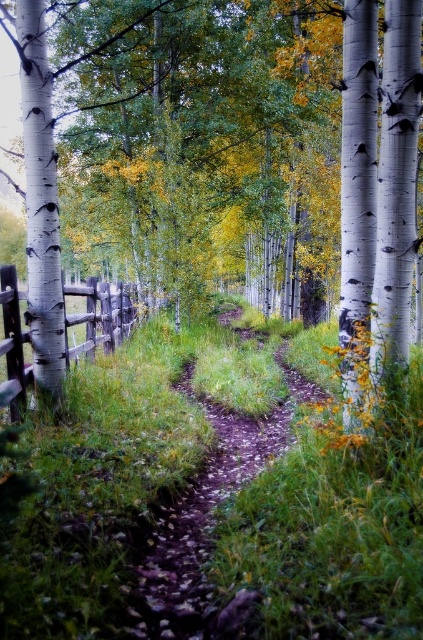
From the picture: You are standing at the starting point of the forest path and want to locate the white smooth tree at center. According to the coordinates provided, in which direction should you walk to reach it?

The white smooth tree at center is located at coordinates point [249,144]. Since the coordinate system is not specified, it is recommended to walk towards the center of the path where the tree is situated.